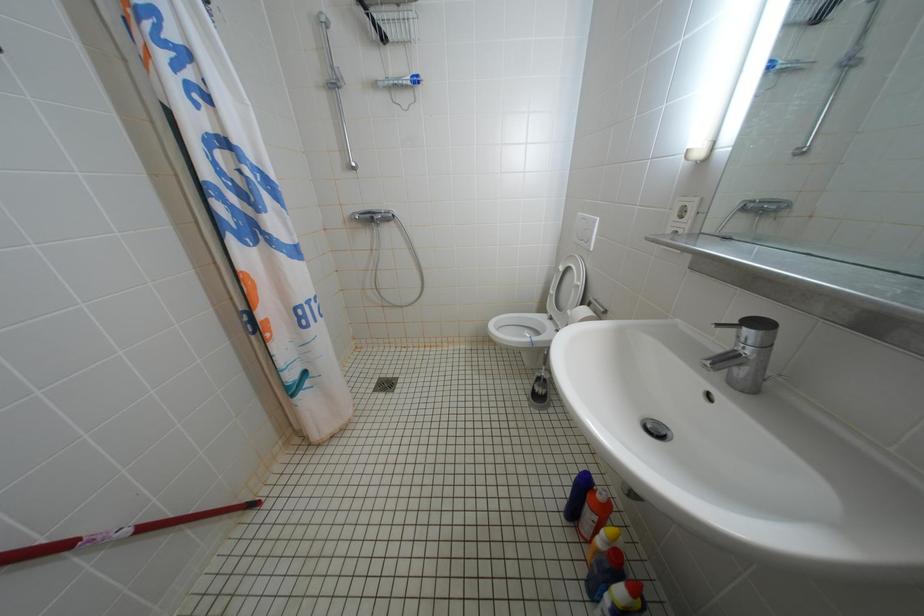
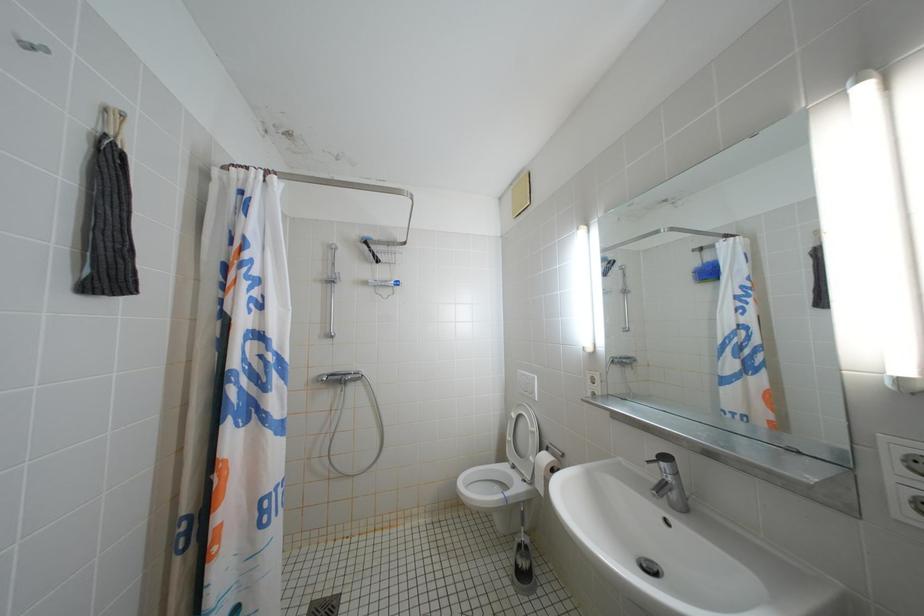
How did the camera likely rotate?

The camera's rotation is toward right-up.